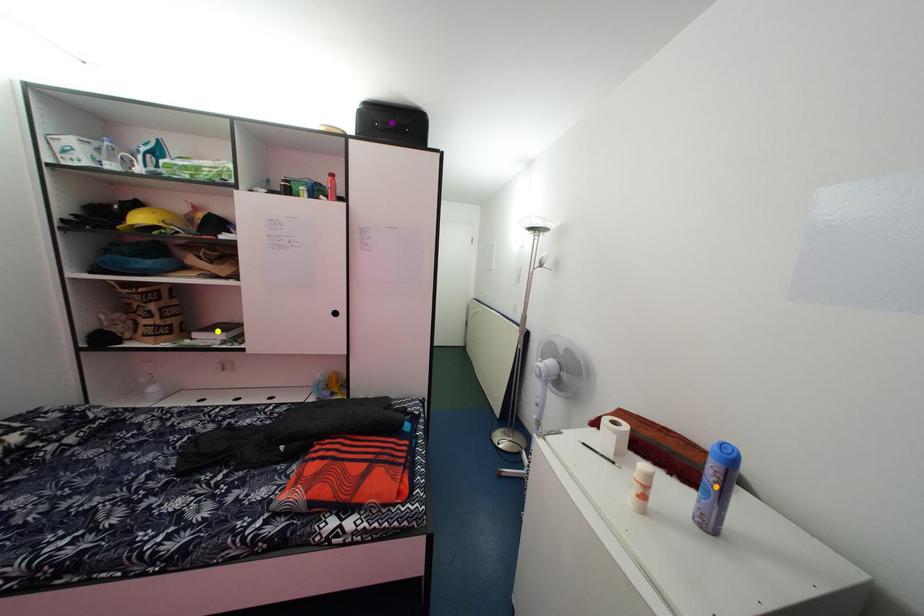
Order these from nearest to farthest:
purple point, yellow point, orange point

purple point, yellow point, orange point